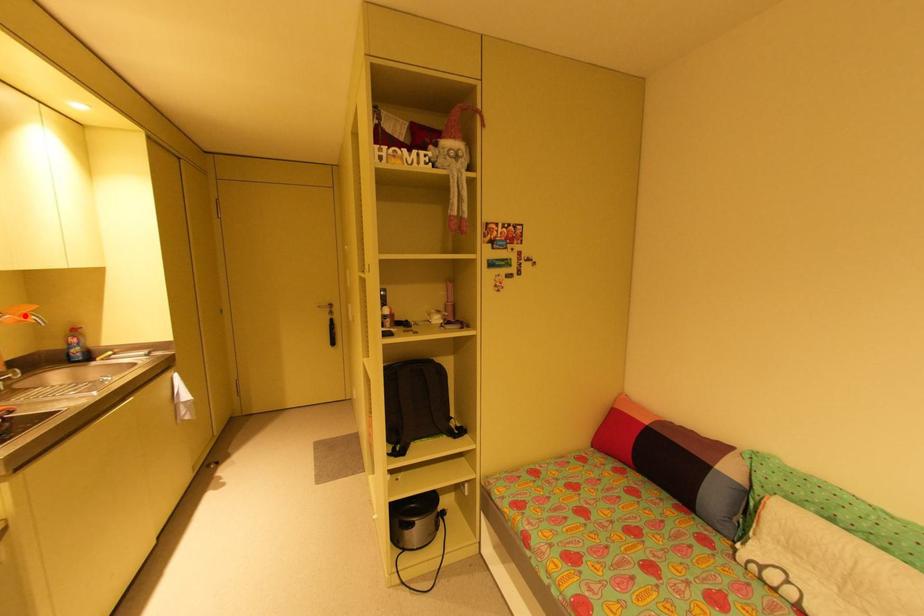
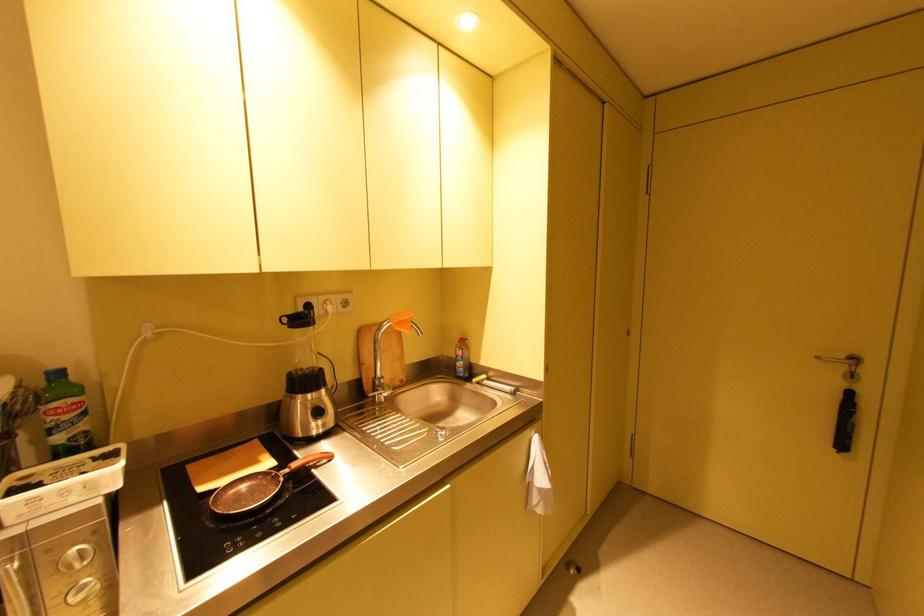
Question: I am providing you with two images of the same scene from different viewpoints. A red point is marked on the first image. Can you still see the location of the red point in image 2?

Choices:
 (A) Yes
 (B) No

Answer: (A)